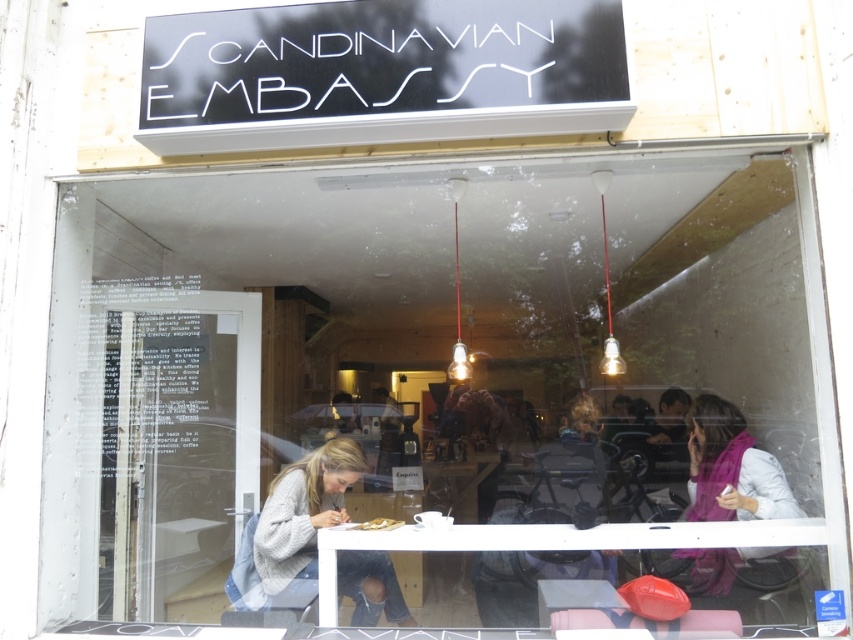
Question: Can you confirm if white plastic table at lower center is positioned to the right of purple scarf at right?

Choices:
 (A) yes
 (B) no

Answer: (B)

Question: Which is farther from the white matte plate at center?

Choices:
 (A) knitted gray sweater at center
 (B) white plastic table at lower center
 (C) purple scarf at right
 (D) transparent glass door at center

Answer: (C)

Question: Estimate the real-world distances between objects in this image. Which object is farther from the purple scarf at right?

Choices:
 (A) transparent glass door at center
 (B) white plastic table at lower center
 (C) knitted gray sweater at center

Answer: (A)

Question: Observing the image, what is the correct spatial positioning of white plastic table at lower center in reference to white matte plate at center?

Choices:
 (A) above
 (B) below

Answer: (B)

Question: Is white plastic table at lower center below purple scarf at right?

Choices:
 (A) no
 (B) yes

Answer: (A)

Question: Which point is closer to the camera?

Choices:
 (A) (389, 522)
 (B) (761, 552)
 (C) (216, 417)

Answer: (B)